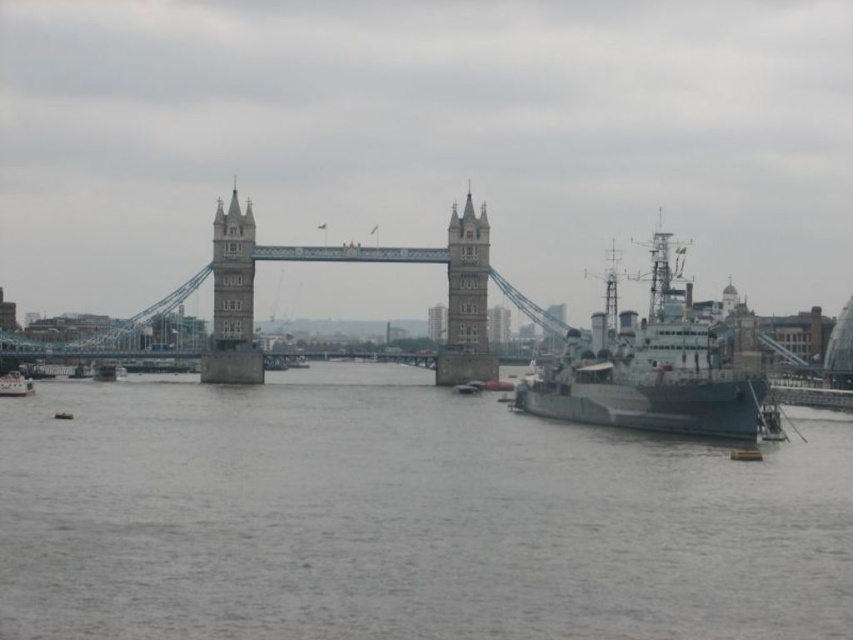
Consider the image. You are standing on the Tower Bridge in London and want to locate the gray water at center. According to the coordinates provided, where exactly should you look relative to the bridge?

The gray water at center is located at coordinates point (x=403, y=516), which means it is positioned slightly to the right and lower center of the bridge structure.

You are standing on the left side of Tower Bridge and want to take a photo of the stone steeple at center and the dark gray metallic ship at right. Which object should you frame first in your camera viewfinder to ensure both are captured in the same shot?

You should frame the stone steeple at center first because the dark gray metallic ship at right is to the right of it, so positioning the steeple centrally will allow the ship to be included on the right side of the frame.

You are standing on the riverbank near Tower Bridge and want to take a photo of both the dark gray metallic ship at right and the stone steeple at center. If you want to include both in your frame, which object should you focus on first to ensure both are in focus?

You should focus on the dark gray metallic ship at right first because it is closer to you than the stone steeple at center. By focusing on the closer object, the steeple will also be in focus due to the depth of field.